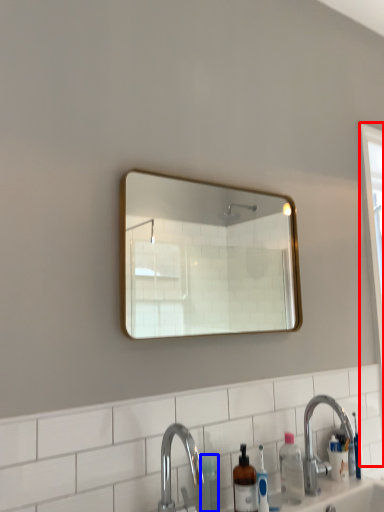
Question: Which of the following is the farthest to the observer, screen door (highlighted by a red box) or toiletry (highlighted by a blue box)?

Choices:
 (A) screen door
 (B) toiletry

Answer: (A)